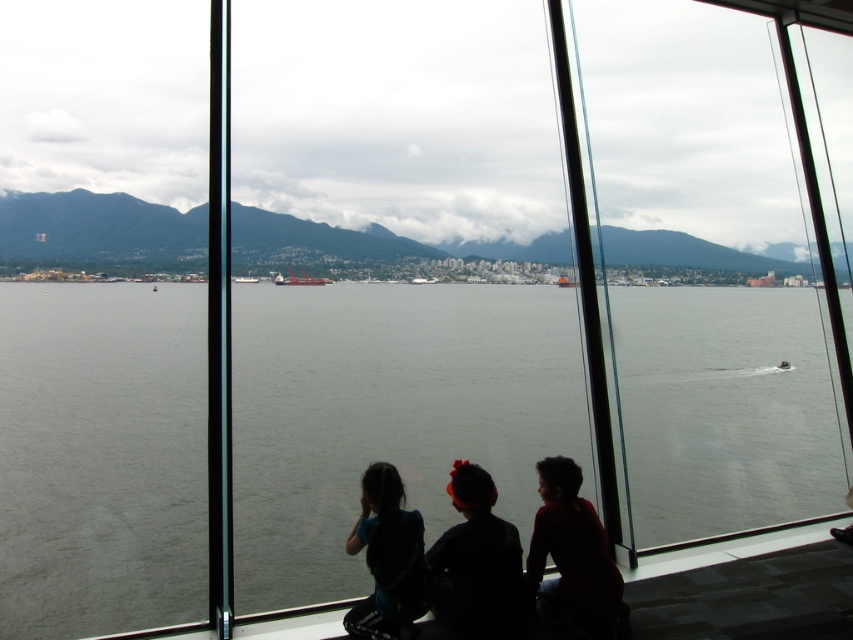
Can you confirm if silhouette fabric child at center is positioned to the left of metallic gray cargo ship at center?

In fact, silhouette fabric child at center is to the right of metallic gray cargo ship at center.

Is point (485, 570) positioned behind point (318, 284)?

That is False.

Locate an element on the screen. silhouette fabric child at center is located at coordinates (477, 563).

Does silhouette fabric child at center have a greater height compared to silhouette of child at right?

In fact, silhouette fabric child at center may be shorter than silhouette of child at right.

Can you confirm if silhouette fabric child at center is positioned to the right of silhouette of child at right?

In fact, silhouette fabric child at center is to the left of silhouette of child at right.

Between point (486, 577) and point (607, 612), which one is positioned in front?

Point (486, 577) is more forward.

I want to click on silhouette fabric child at center, so (x=477, y=563).

Based on the photo, is silhouette fabric child at center bigger than silhouette fabric child at lower center?

Indeed, silhouette fabric child at center has a larger size compared to silhouette fabric child at lower center.

From the picture: How far apart are silhouette fabric child at center and silhouette fabric child at lower center?

The distance of silhouette fabric child at center from silhouette fabric child at lower center is 26.68 centimeters.

Between point (473, 588) and point (390, 609), which one is positioned in front?

Point (390, 609) is in front.

Image resolution: width=853 pixels, height=640 pixels. What are the coordinates of `silhouette fabric child at center` in the screenshot? It's located at (477, 563).